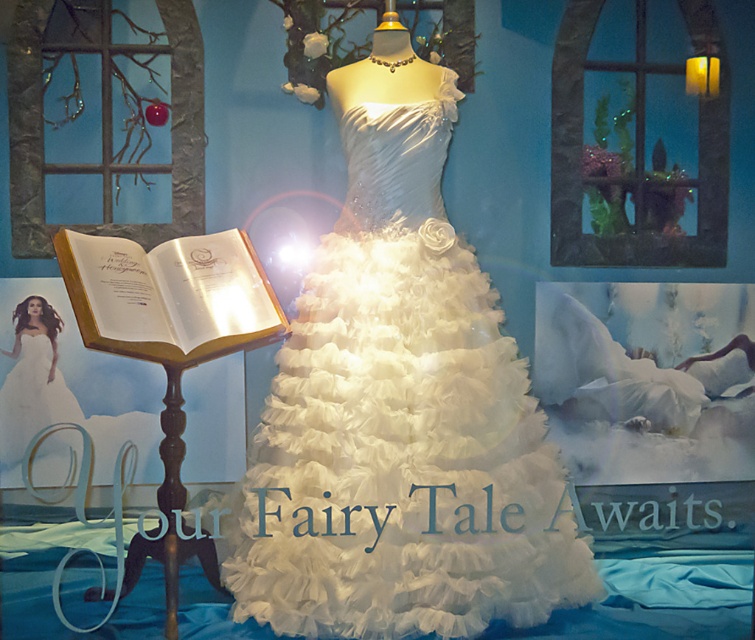
You are standing in front of the display setup and want to know which of the two points, point (344, 332) or point (220, 288), is closer to you. Based on the scene description, can you determine which point is nearer?

Point (344, 332) is in front of point (220, 288), so it is closer to you.

You are a photographer positioned at the back of the room, aiming to capture the white tulle dress at center and the white paper book at left. Which object will appear larger in your photo?

The white tulle dress at center will appear larger in the photo because it is closer to the photographer than the white paper book at left.

You are a guest at a magical exhibition and notice the translucent glass at upper right and the white paper book at left. Which object is located to the right of the other?

The translucent glass at upper right is positioned on the right side of white paper book at left.